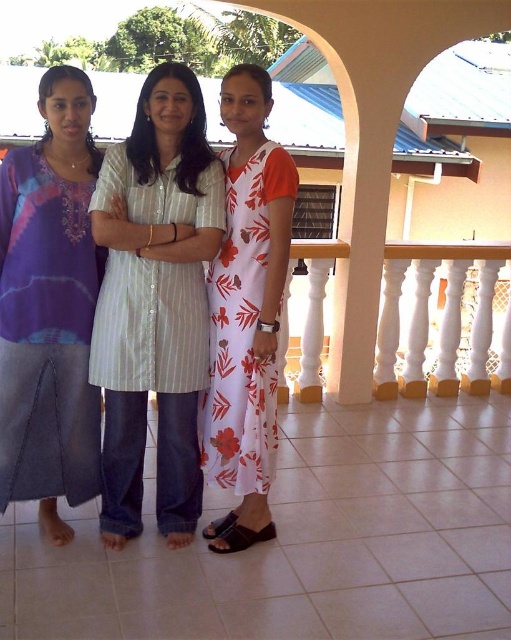
Can you confirm if white striped shirt at center is taller than white plastic balustrade at right?

Yes, white striped shirt at center is taller than white plastic balustrade at right.

Who is more forward, (197, 120) or (422, 330)?

Point (197, 120) is more forward.

Locate an element on the screen. This screenshot has height=640, width=511. white striped shirt at center is located at coordinates (154, 301).

Does white floral dress at center have a lesser height compared to white plastic balustrade at right?

No.

Which is behind, point (268, 532) or point (467, 380)?

Point (467, 380)

Is point (286, 186) positioned in front of point (498, 262)?

Yes, point (286, 186) is closer to viewer.

Find the location of a particular element. white floral dress at center is located at coordinates (246, 310).

Which is more to the right, white striped shirt at center or matte tie-dye top at left?

white striped shirt at center is more to the right.

This screenshot has width=511, height=640. Identify the location of white striped shirt at center. (154, 301).